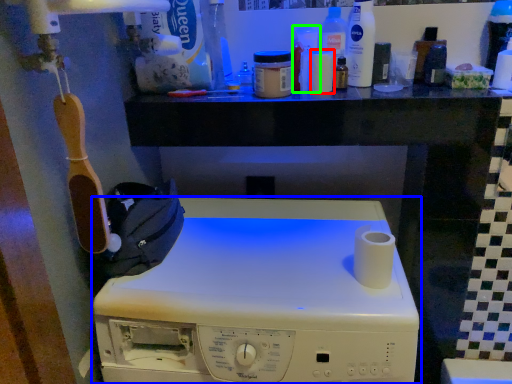
Question: Which object is positioned closest to toiletry (highlighted by a red box)? Select from home appliance (highlighted by a blue box) and toiletry (highlighted by a green box).

Choices:
 (A) home appliance
 (B) toiletry

Answer: (B)